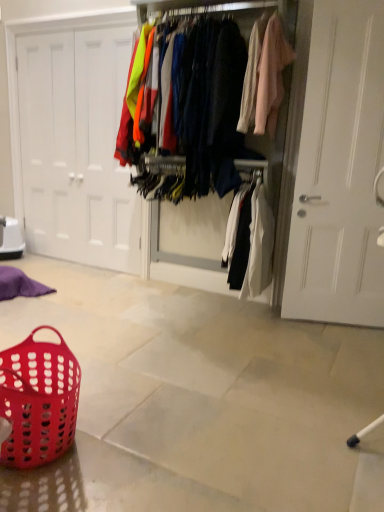
Question: Does translucent red plastic basket at lower left have a greater height compared to matte fabric clothes at center?

Choices:
 (A) yes
 (B) no

Answer: (B)

Question: From a real-world perspective, is translucent red plastic basket at lower left positioned under matte fabric clothes at center based on gravity?

Choices:
 (A) yes
 (B) no

Answer: (A)

Question: Is translucent red plastic basket at lower left positioned far away from matte fabric clothes at center?

Choices:
 (A) yes
 (B) no

Answer: (A)

Question: Is the position of translucent red plastic basket at lower left less distant than that of matte fabric clothes at center?

Choices:
 (A) yes
 (B) no

Answer: (A)

Question: Is translucent red plastic basket at lower left smaller than matte fabric clothes at center?

Choices:
 (A) yes
 (B) no

Answer: (A)

Question: Considering the positions of point (205, 227) and point (39, 112), is point (205, 227) closer or farther from the camera than point (39, 112)?

Choices:
 (A) farther
 (B) closer

Answer: (B)

Question: Considering the positions of matte fabric clothes at center and white matte door at left in the image, is matte fabric clothes at center taller or shorter than white matte door at left?

Choices:
 (A) tall
 (B) short

Answer: (B)

Question: From the image's perspective, is matte fabric clothes at center above or below white matte door at left?

Choices:
 (A) below
 (B) above

Answer: (A)

Question: Is matte fabric clothes at center to the left or to the right of white matte door at left in the image?

Choices:
 (A) right
 (B) left

Answer: (A)

Question: From a real-world perspective, relative to white matte door at left, is translucent red plastic basket at lower left vertically above or below?

Choices:
 (A) above
 (B) below

Answer: (B)

Question: Is point (66, 389) closer or farther from the camera than point (34, 148)?

Choices:
 (A) closer
 (B) farther

Answer: (A)

Question: From the image's perspective, is translucent red plastic basket at lower left above or below white matte door at left?

Choices:
 (A) above
 (B) below

Answer: (B)

Question: Considering the positions of translucent red plastic basket at lower left and white matte door at left in the image, is translucent red plastic basket at lower left taller or shorter than white matte door at left?

Choices:
 (A) tall
 (B) short

Answer: (B)

Question: Considering the positions of translucent red plastic basket at lower left and matte fabric clothes at center in the image, is translucent red plastic basket at lower left taller or shorter than matte fabric clothes at center?

Choices:
 (A) tall
 (B) short

Answer: (B)

Question: Is point (51, 377) closer or farther from the camera than point (200, 237)?

Choices:
 (A) closer
 (B) farther

Answer: (A)